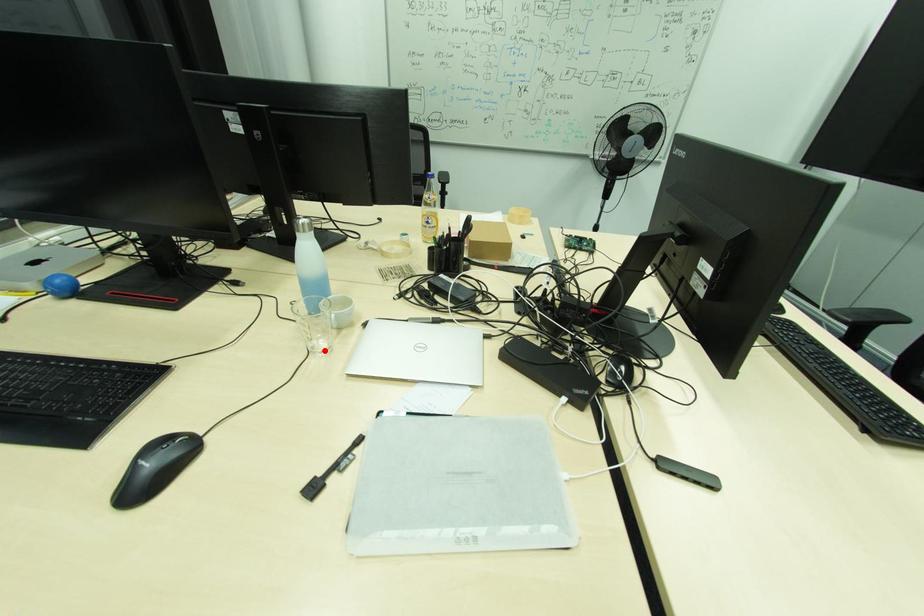
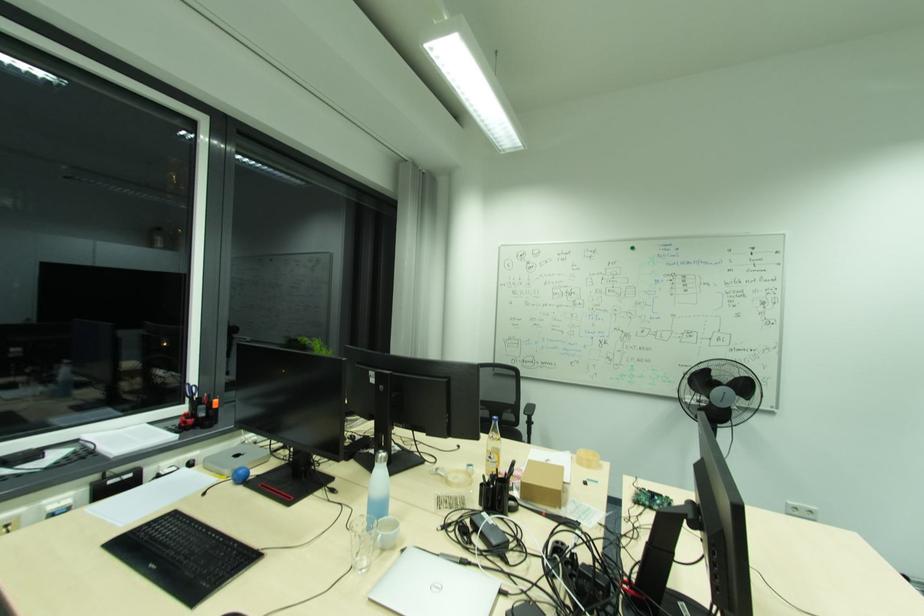
In the second image, find the point that corresponds to the highlighted location in the first image.

(363, 568)